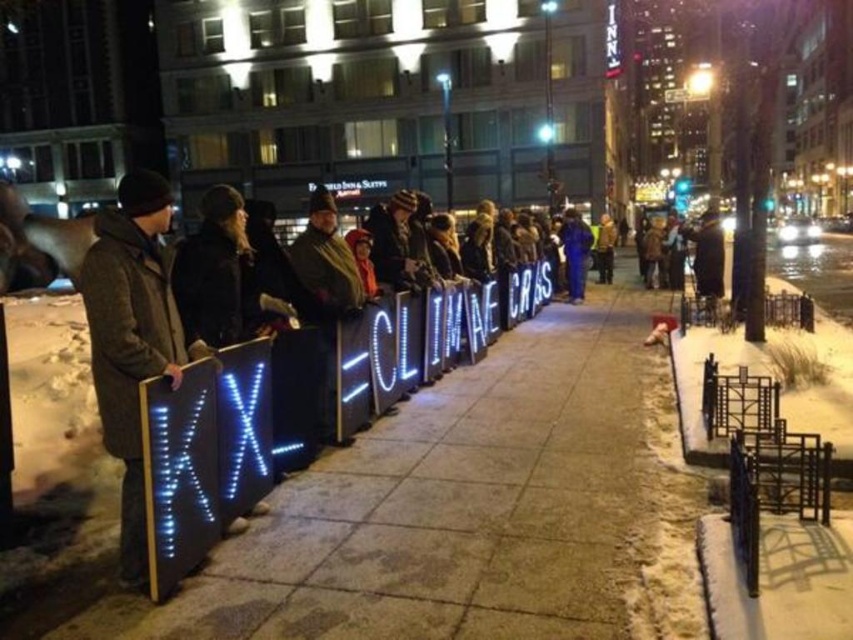
Does dark gray wool coat at left appear on the right side of blue fabric jacket at center?

Incorrect, dark gray wool coat at left is not on the right side of blue fabric jacket at center.

Is dark gray wool coat at left taller than blue fabric jacket at center?

No, dark gray wool coat at left is not taller than blue fabric jacket at center.

Is point (136, 442) closer to camera compared to point (569, 234)?

Yes.

You are a GUI agent. You are given a task and a screenshot of the screen. Output one action in this format:
    pyautogui.click(x=<x>, y=<y>)
    Task: Click on the dark gray wool coat at left
    The image size is (853, 640).
    Given the screenshot: What is the action you would take?
    pyautogui.click(x=132, y=337)

Is concrete sidewalk at center in front of dark gray wool coat at left?

Yes, concrete sidewalk at center is in front of dark gray wool coat at left.

Is point (410, 529) farther from camera compared to point (155, 244)?

Yes.

This screenshot has height=640, width=853. What do you see at coordinates (440, 513) in the screenshot?
I see `concrete sidewalk at center` at bounding box center [440, 513].

You are a GUI agent. You are given a task and a screenshot of the screen. Output one action in this format:
    pyautogui.click(x=<x>, y=<y>)
    Task: Click on the concrete sidewalk at center
    
    Given the screenshot: What is the action you would take?
    pyautogui.click(x=440, y=513)

Which is more to the right, concrete sidewalk at center or blue fabric jacket at center?

blue fabric jacket at center is more to the right.

Measure the distance between point (225,604) and camera.

A: Point (225,604) and camera are 3.40 meters apart.

Where is `concrete sidewalk at center`? This screenshot has height=640, width=853. concrete sidewalk at center is located at coordinates click(x=440, y=513).